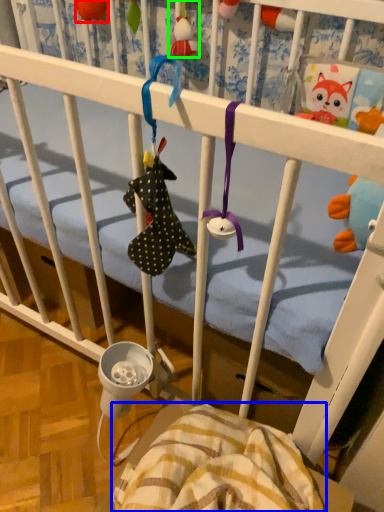
Question: Estimate the real-world distances between objects in this image. Which object is closer to toy (highlighted by a red box), blanket (highlighted by a blue box) or toy (highlighted by a green box)?

Choices:
 (A) blanket
 (B) toy

Answer: (B)